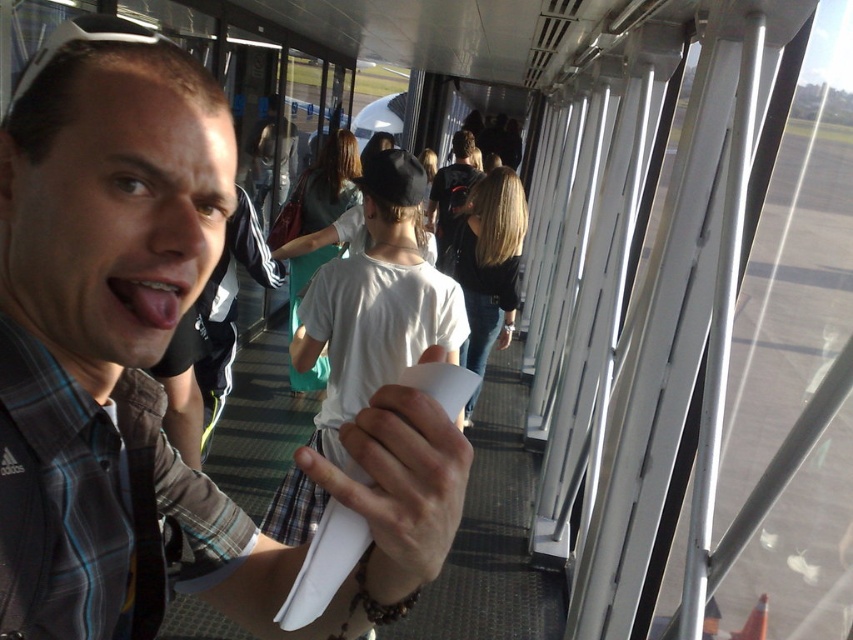
Between plaid shirt at left and white matte shirt at center, which one is positioned lower?

plaid shirt at left is below.

Between point (97, 337) and point (402, 154), which one is positioned behind?

The point (402, 154) is behind.

What are the coordinates of `plaid shirt at left` in the screenshot? It's located at (155, 364).

Locate an element on the screen. The width and height of the screenshot is (853, 640). plaid shirt at left is located at coordinates 155,364.

How much distance is there between white matte shirt at center and white paper at center?

A distance of 1.33 meters exists between white matte shirt at center and white paper at center.

Describe the element at coordinates (376, 301) in the screenshot. I see `white matte shirt at center` at that location.

Identify the location of white matte shirt at center. Image resolution: width=853 pixels, height=640 pixels. (376, 301).

Find the location of `white matte shirt at center`. white matte shirt at center is located at coordinates (376, 301).

Does point (418, 419) come closer to viewer compared to point (141, 285)?

Yes, it is in front of point (141, 285).

Which of these two, white paper at center or pink glossy tongue at center, stands taller?

With more height is white paper at center.

Locate an element on the screen. This screenshot has height=640, width=853. white paper at center is located at coordinates [399, 484].